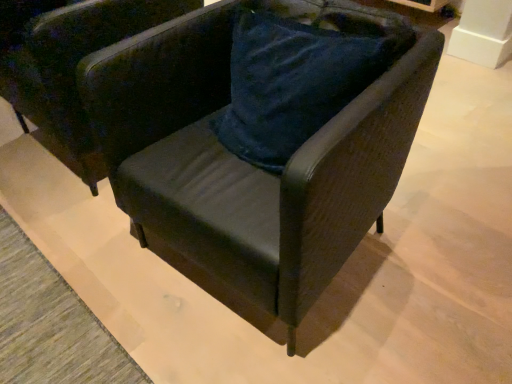
Question: Looking at their shapes, would you say velvet dark green armchair at center, the 1th chair in the right-to-left sequence, is wider or thinner than velvet dark green armchair at center, acting as the first chair starting from the left?

Choices:
 (A) thin
 (B) wide

Answer: (A)

Question: Is point (120, 97) closer or farther from the camera than point (86, 31)?

Choices:
 (A) farther
 (B) closer

Answer: (B)

Question: Visually, is velvet dark green armchair at center, the 2th chair viewed from the left, positioned to the left or to the right of velvet dark green armchair at center, the 2th chair positioned from the right?

Choices:
 (A) left
 (B) right

Answer: (B)

Question: Is velvet dark green armchair at center, the 2th chair positioned from the right, bigger or smaller than velvet dark green armchair at center, the 1th chair in the right-to-left sequence?

Choices:
 (A) big
 (B) small

Answer: (A)

Question: Is velvet dark green armchair at center, the 2th chair positioned from the right, in front of or behind velvet dark green armchair at center, the 1th chair in the right-to-left sequence, in the image?

Choices:
 (A) front
 (B) behind

Answer: (B)

Question: Is velvet dark green armchair at center, the 2th chair positioned from the right, inside or outside of velvet dark green armchair at center, the 2th chair viewed from the left?

Choices:
 (A) inside
 (B) outside

Answer: (B)

Question: From their relative heights in the image, would you say velvet dark green armchair at center, acting as the first chair starting from the left, is taller or shorter than velvet dark green armchair at center, the 2th chair viewed from the left?

Choices:
 (A) short
 (B) tall

Answer: (A)